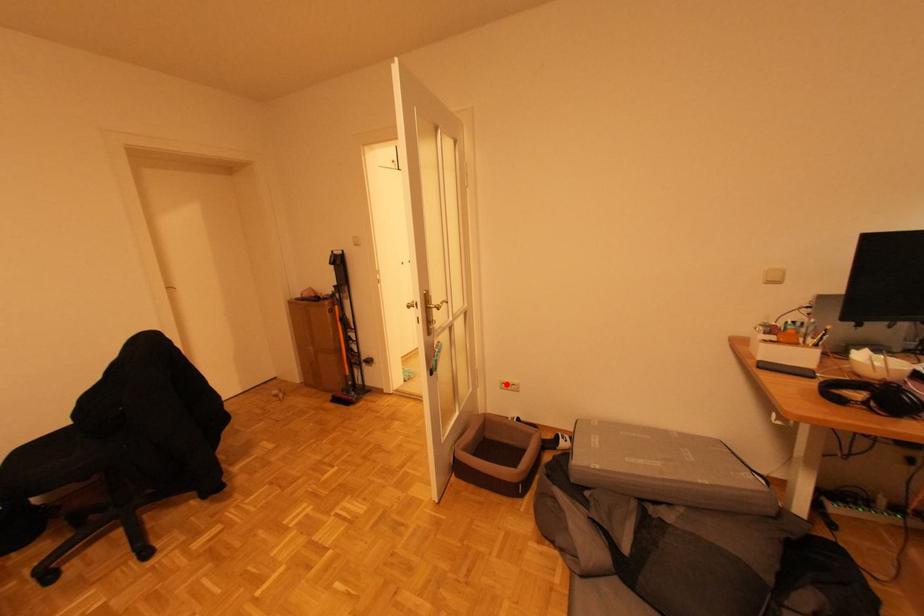
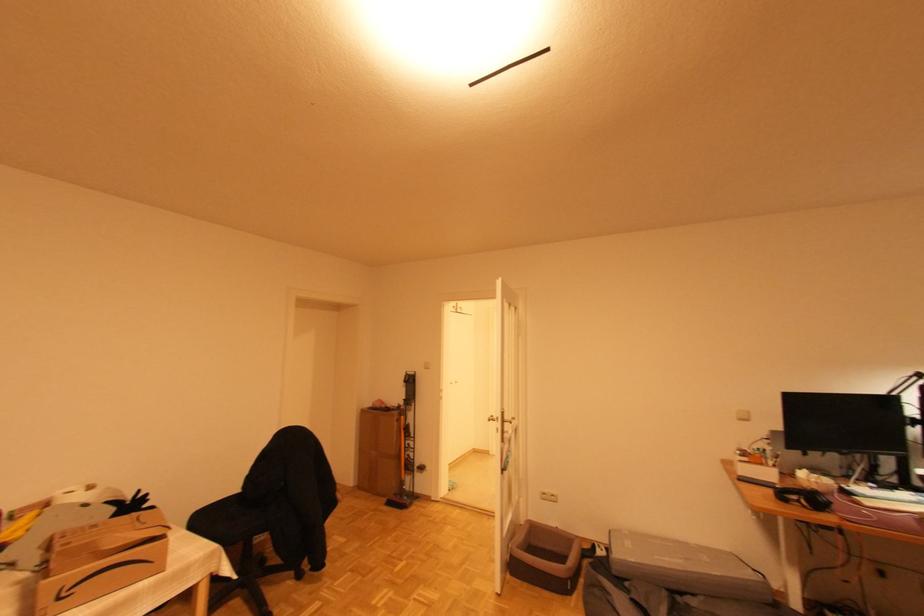
In the second image, find the point that corresponds to the highlighted location in the first image.

(546, 495)